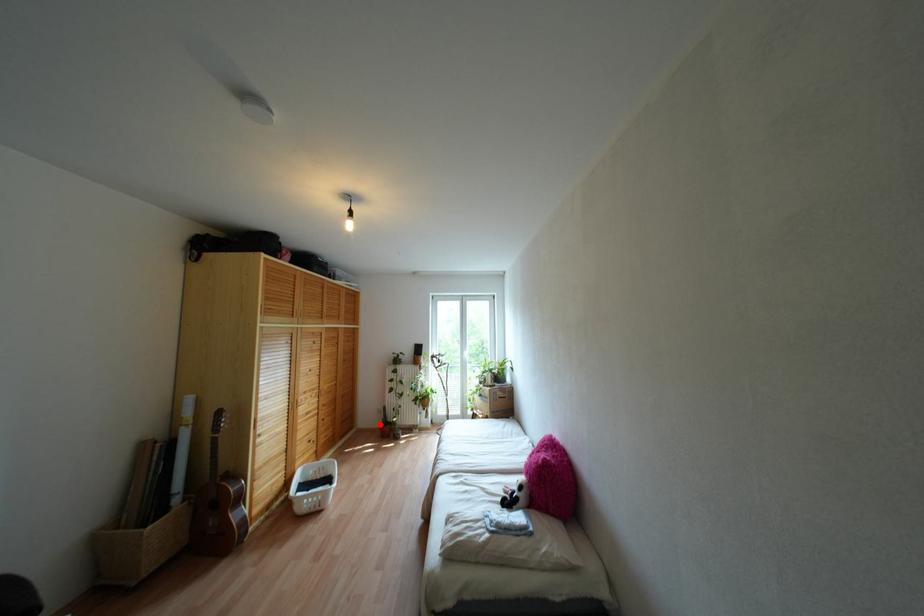
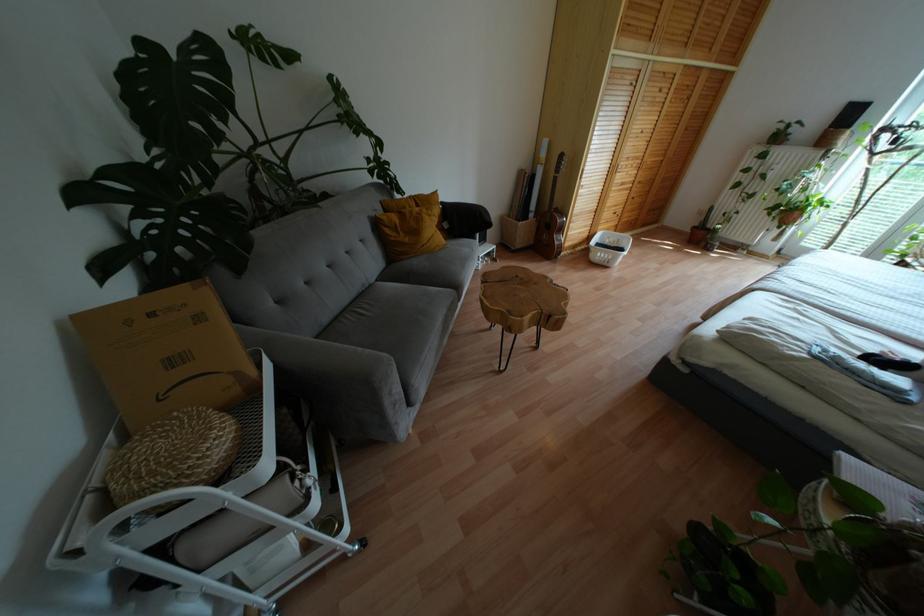
Find the pixel in the second image that matches the highlighted location in the first image.

(694, 227)